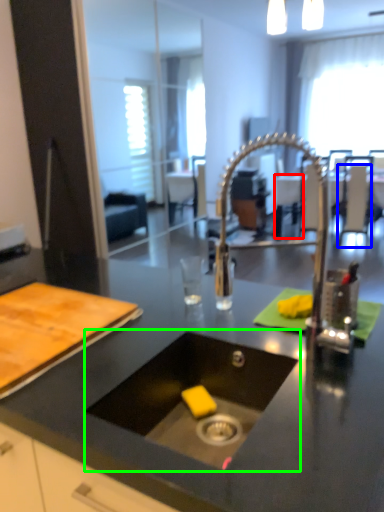
Question: Estimate the real-world distances between objects in this image. Which object is farther from chair (highlighted by a red box), chair (highlighted by a blue box) or sink (highlighted by a green box)?

Choices:
 (A) chair
 (B) sink

Answer: (B)